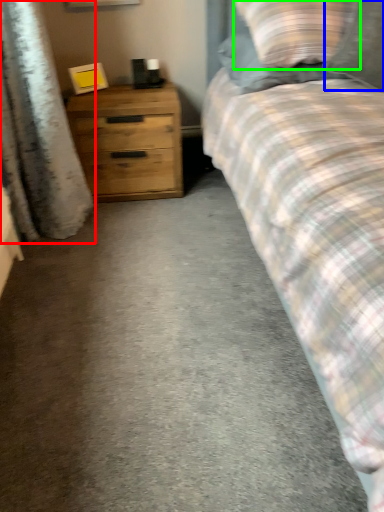
Question: Which is farther away from curtain (highlighted by a red box)? pillow (highlighted by a blue box) or pillow (highlighted by a green box)?

Choices:
 (A) pillow
 (B) pillow

Answer: (A)